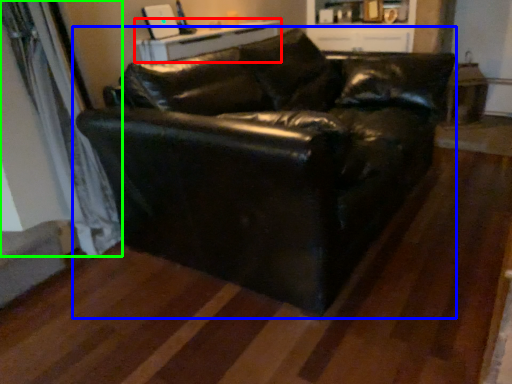
Question: Which is farther away from table (highlighted by a red box)? studio couch (highlighted by a blue box) or curtain (highlighted by a green box)?

Choices:
 (A) studio couch
 (B) curtain

Answer: (A)